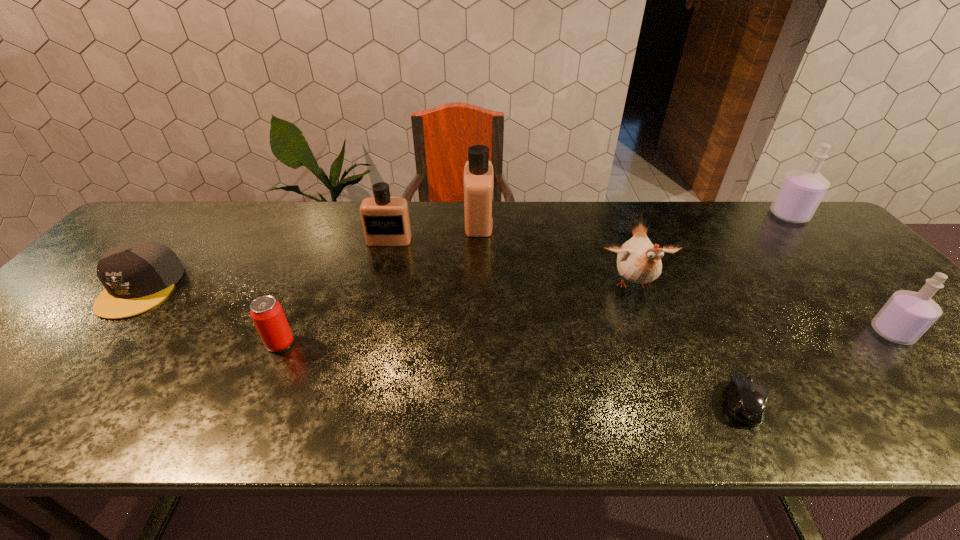
The height and width of the screenshot is (540, 960). Identify the location of the seventh closest object to the bird. (137, 276).

Find the location of `object that can be found as the sixth closest to the white bird`. object that can be found as the sixth closest to the white bird is located at coordinates (266, 312).

Identify which perfume is the nearest to the fifth object from right to left. Please provide its 2D coordinates. Your answer should be formatted as a tuple, i.e. [(x, y)], where the tuple contains the x and y coordinates of a point satisfying the conditions above.

[(385, 220)]

The image size is (960, 540). Identify the location of perfume that is the closest to the nearest perfume. (801, 191).

Identify the location of free location that satisfies the following two spatial constraints: 1. on the back side of the nearer purple perfume; 2. on the front label of the second perfume from left to right. (787, 221).

Identify the location of free space in the image that satisfies the following two spatial constraints: 1. at the beak of the black mouse; 2. on the left side of the white bird. Image resolution: width=960 pixels, height=540 pixels. (679, 403).

This screenshot has height=540, width=960. Find the location of `free spot that satisfies the following two spatial constraints: 1. at the beak of the nearer purple perfume; 2. on the left side of the bird`. free spot that satisfies the following two spatial constraints: 1. at the beak of the nearer purple perfume; 2. on the left side of the bird is located at coordinates (652, 333).

The height and width of the screenshot is (540, 960). I want to click on vacant area that satisfies the following two spatial constraints: 1. on the front label of the bigger beige perfume; 2. on the back side of the shortest object, so click(478, 403).

In order to click on free spot that satisfies the following two spatial constraints: 1. on the front-facing side of the gray cap; 2. on the left side of the shortest object in this screenshot , I will do pos(42,403).

Locate an element on the screen. Image resolution: width=960 pixels, height=540 pixels. vacant region that satisfies the following two spatial constraints: 1. on the front label of the right beige perfume; 2. on the front side of the third shortest object is located at coordinates (478, 343).